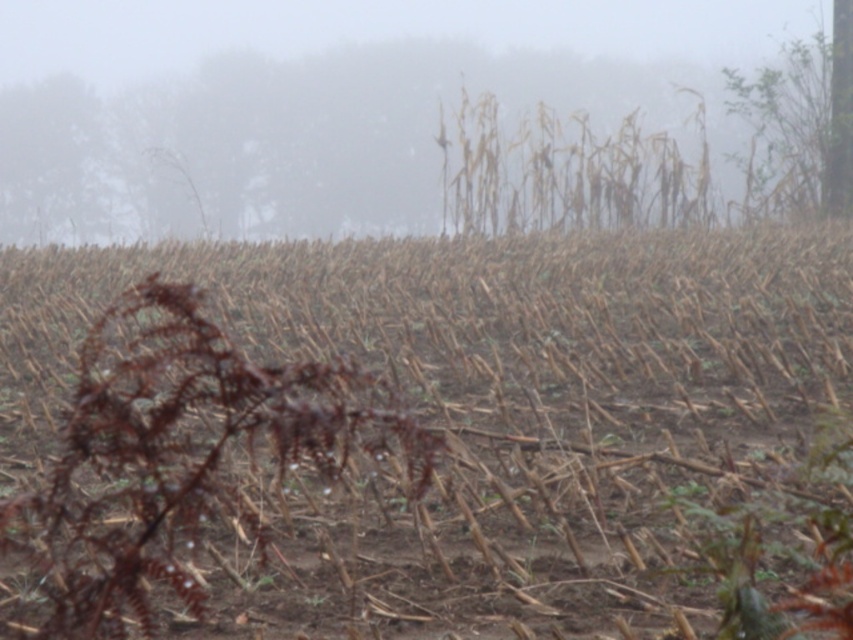
Is brown dry stalks at center wider than foggy haze at upper center?

No, brown dry stalks at center is not wider than foggy haze at upper center.

Is brown dry stalks at center positioned before foggy haze at upper center?

Yes, it is.

From the picture: Who is more forward, (50, 472) or (302, 80)?

Positioned in front is point (50, 472).

At what (x,y) coordinates should I click in order to perform the action: click on brown dry stalks at center. Please return your answer as a coordinate pair (x, y). This screenshot has height=640, width=853. Looking at the image, I should click on (422, 435).